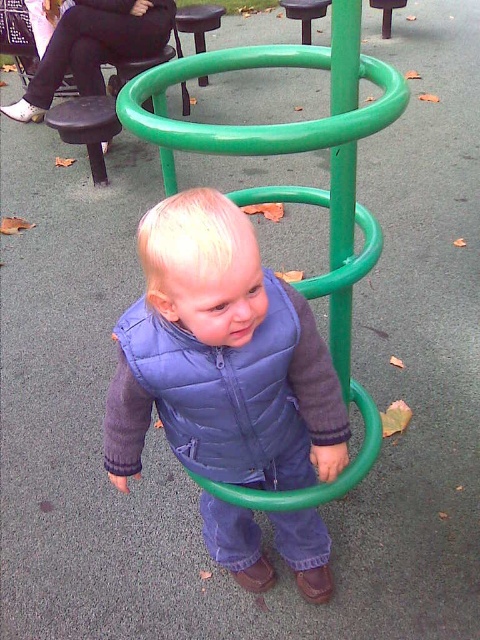
Is green rubber hula hoop at center closer to camera compared to black plastic stool at upper left?

Yes, green rubber hula hoop at center is in front of black plastic stool at upper left.

Who is higher up, green rubber hula hoop at center or black plastic stool at upper left?

black plastic stool at upper left

Describe the element at coordinates (294, 189) in the screenshot. I see `green rubber hula hoop at center` at that location.

Identify the location of green rubber hula hoop at center. This screenshot has width=480, height=640. (294, 189).

Which is more to the left, black plastic stool at upper left or black plastic stool at upper center?

black plastic stool at upper left

Can you confirm if black plastic stool at upper left is positioned to the right of black plastic stool at upper center?

Incorrect, black plastic stool at upper left is not on the right side of black plastic stool at upper center.

Is point (47, 120) farther from camera compared to point (205, 26)?

No, (47, 120) is closer to viewer.

This screenshot has width=480, height=640. What are the coordinates of `black plastic stool at upper left` in the screenshot? It's located at (86, 128).

Who is higher up, green rubber hula hoop at center or black plastic stool at upper center?

black plastic stool at upper center is above.

Does green rubber hula hoop at center have a larger size compared to black plastic stool at upper center?

Correct, green rubber hula hoop at center is larger in size than black plastic stool at upper center.

Which is behind, point (349, 182) or point (203, 12)?

The point (203, 12) is behind.

Image resolution: width=480 pixels, height=640 pixels. Find the location of `green rubber hula hoop at center`. green rubber hula hoop at center is located at coordinates (294, 189).